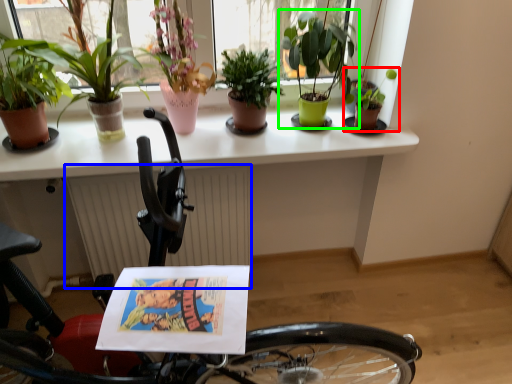
Question: Which object is positioned closest to houseplant (highlighted by a red box)? Select from radiator (highlighted by a blue box) and houseplant (highlighted by a green box).

Choices:
 (A) radiator
 (B) houseplant

Answer: (B)